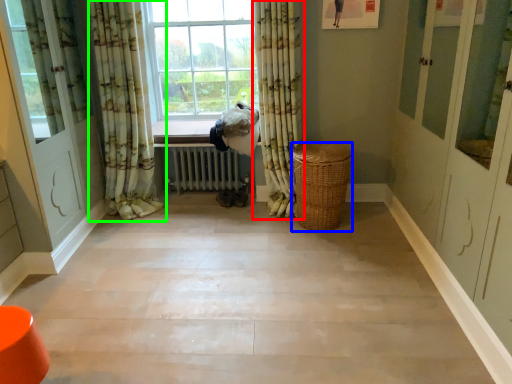
Question: Considering the real-world distances, which object is farthest from curtain (highlighted by a red box)? basket (highlighted by a blue box) or curtain (highlighted by a green box)?

Choices:
 (A) basket
 (B) curtain

Answer: (B)